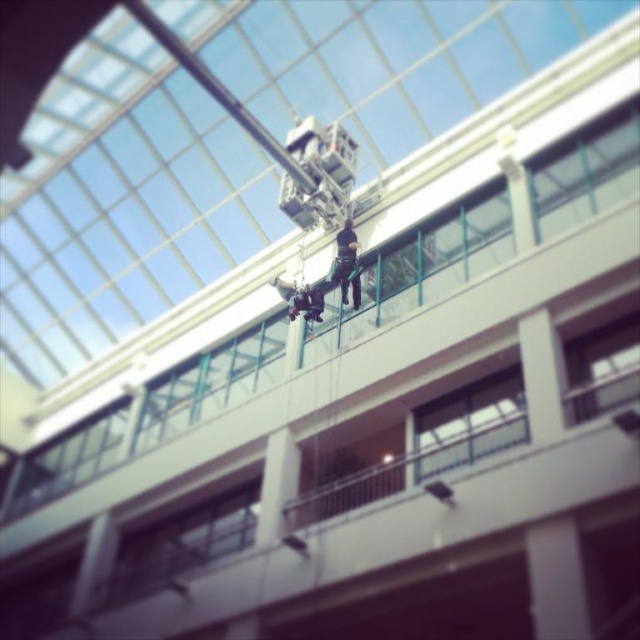
Question: Which of the following is the closest to the observer?

Choices:
 (A) transparent glass window at lower center
 (B) transparent glass window at center
 (C) clear glass window at upper center
 (D) clear glass window at center

Answer: (B)

Question: Among these objects, which one is nearest to the camera?

Choices:
 (A) clear glass window at upper center
 (B) transparent glass window at center
 (C) transparent glass window at lower center

Answer: (B)

Question: Does clear glass window at upper center appear under transparent glass window at lower center?

Choices:
 (A) yes
 (B) no

Answer: (B)

Question: Can you confirm if transparent glass window at lower center is positioned above clear glass window at center?

Choices:
 (A) yes
 (B) no

Answer: (B)

Question: Which of the following is the closest to the observer?

Choices:
 (A) (516, 413)
 (B) (552, 221)
 (C) (193, 518)
 (D) (579, 380)

Answer: (A)

Question: Considering the relative positions of clear glass window at upper center and clear glass window at center in the image provided, where is clear glass window at upper center located with respect to clear glass window at center?

Choices:
 (A) below
 (B) above

Answer: (B)